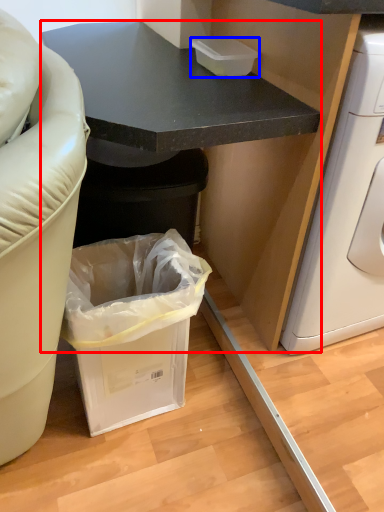
Question: Which object is closer to the camera taking this photo, cabinetry (highlighted by a red box) or box (highlighted by a blue box)?

Choices:
 (A) cabinetry
 (B) box

Answer: (A)